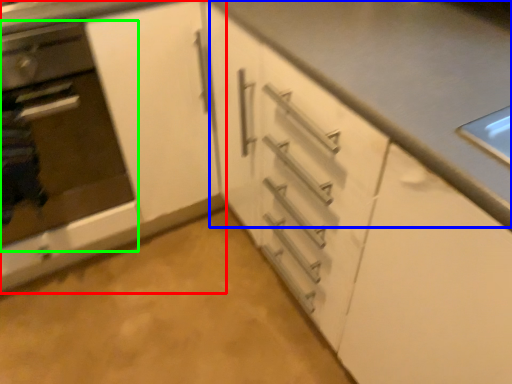
Question: Which object is positioned farthest from cabinetry (highlighted by a red box)? Select from counter top (highlighted by a blue box) and oven (highlighted by a green box).

Choices:
 (A) counter top
 (B) oven

Answer: (A)